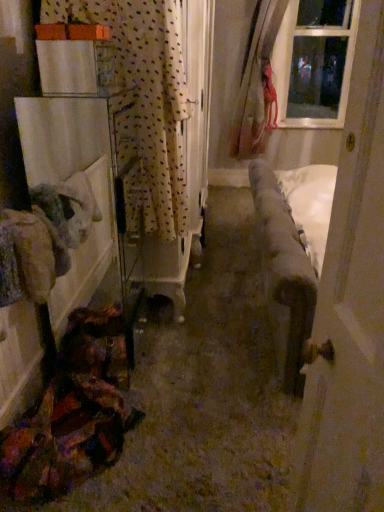
Question: Considering their positions, is clear glass window at upper right located in front of or behind velvet fabric couch at center?

Choices:
 (A) front
 (B) behind

Answer: (B)

Question: From the image's perspective, is clear glass window at upper right above or below velvet fabric couch at center?

Choices:
 (A) below
 (B) above

Answer: (B)

Question: Which is nearer to the velvet fabric couch at center?

Choices:
 (A) wooden door at right
 (B) white polka dot fabric at left
 (C) clear glass window at upper right

Answer: (A)

Question: Considering the real-world distances, which object is closest to the white polka dot fabric at left?

Choices:
 (A) wooden door at right
 (B) clear glass window at upper right
 (C) velvet fabric couch at center

Answer: (C)